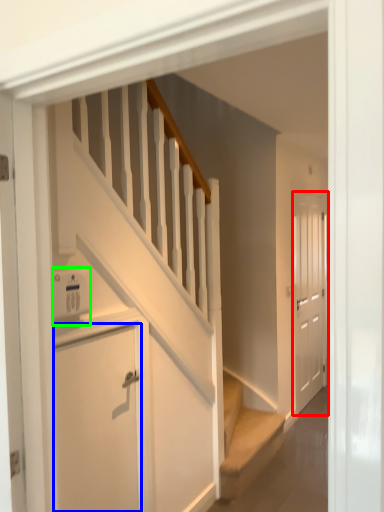
Question: Which object is the closest to the door (highlighted by a red box)? Choose among these: door (highlighted by a blue box) or appliance (highlighted by a green box).

Choices:
 (A) door
 (B) appliance

Answer: (A)